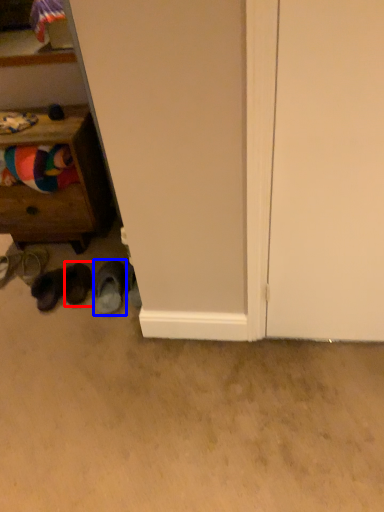
Question: Which point is further to the camera, footwear (highlighted by a red box) or footwear (highlighted by a blue box)?

Choices:
 (A) footwear
 (B) footwear

Answer: (A)